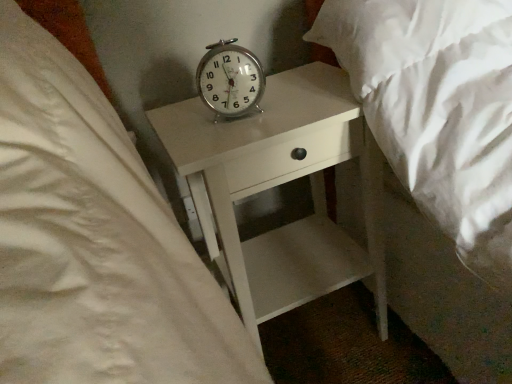
Question: Is metallic silver alarm clock at center wider or thinner than white glossy nightstand at center?

Choices:
 (A) wide
 (B) thin

Answer: (B)

Question: From a real-world perspective, relative to white glossy nightstand at center, is metallic silver alarm clock at center vertically above or below?

Choices:
 (A) above
 (B) below

Answer: (A)

Question: Is metallic silver alarm clock at center in front of or behind white glossy nightstand at center in the image?

Choices:
 (A) behind
 (B) front

Answer: (A)

Question: Is point (176, 127) positioned closer to the camera than point (248, 86)?

Choices:
 (A) closer
 (B) farther

Answer: (B)

Question: In the image, is white glossy nightstand at center positioned in front of or behind metallic silver alarm clock at center?

Choices:
 (A) front
 (B) behind

Answer: (A)

Question: Would you say white glossy nightstand at center is inside or outside metallic silver alarm clock at center?

Choices:
 (A) outside
 (B) inside

Answer: (A)

Question: From a real-world perspective, is white glossy nightstand at center physically located above or below metallic silver alarm clock at center?

Choices:
 (A) above
 (B) below

Answer: (B)